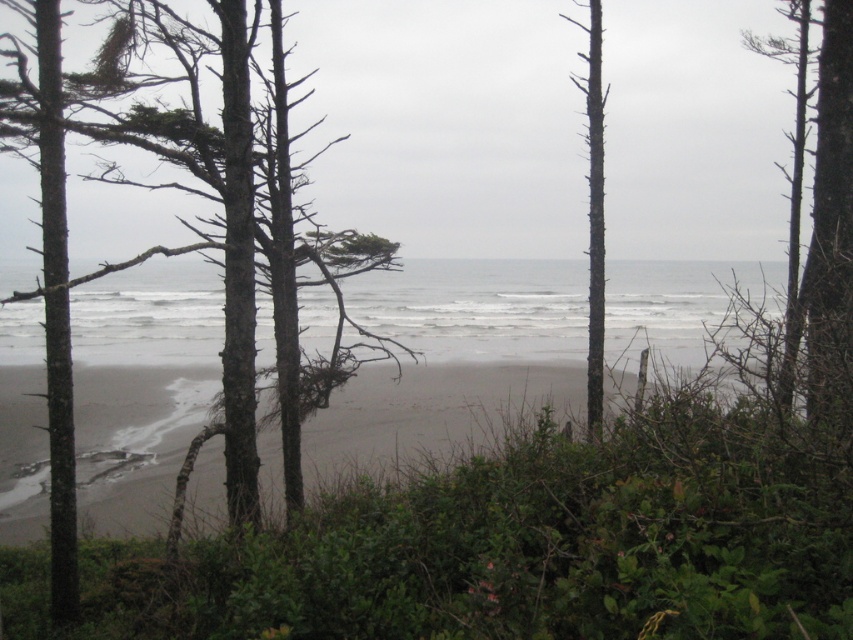
Does gray sand at center have a greater width compared to smooth bark tree at right?

In fact, gray sand at center might be narrower than smooth bark tree at right.

Is gray sand at center taller than smooth bark tree at right?

No, gray sand at center is not taller than smooth bark tree at right.

Where is `gray sand at center`? The image size is (853, 640). gray sand at center is located at coordinates (430, 410).

Between gray sand at center and smooth gray bark tree at center, which one appears on the right side from the viewer's perspective?

smooth gray bark tree at center is more to the right.

Which is behind, point (80, 422) or point (587, 93)?

Positioned behind is point (80, 422).

The height and width of the screenshot is (640, 853). Find the location of `gray sand at center`. gray sand at center is located at coordinates (430, 410).

Does gray sand at center appear over smooth bark tree at center?

No, gray sand at center is not above smooth bark tree at center.

Who is more distant from viewer, (78, 420) or (259, 324)?

Positioned behind is point (259, 324).

Is point (38, 518) less distant than point (375, 266)?

No, it is not.

This screenshot has width=853, height=640. I want to click on gray sand at center, so click(x=430, y=410).